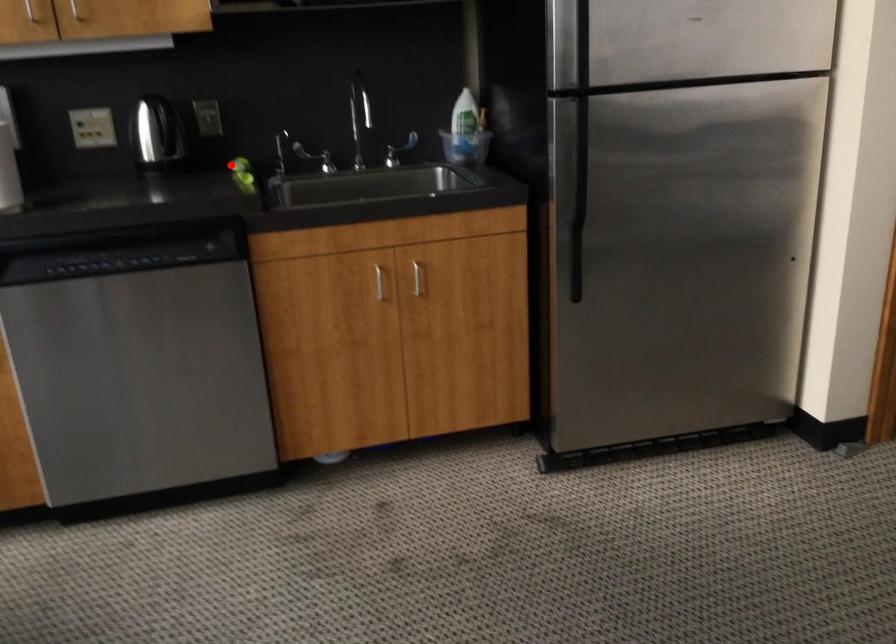
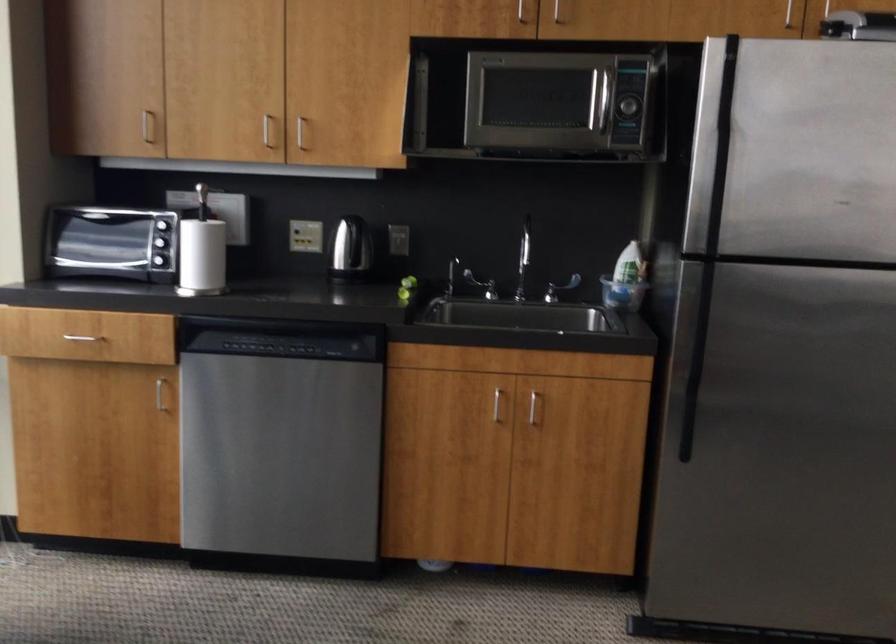
Question: I am providing you with two images of the same scene from different viewpoints. In image1, a red point is highlighted. Considering the same 3D point in image2, which of the following is correct?

Choices:
 (A) It is closer
 (B) It is farther

Answer: (B)